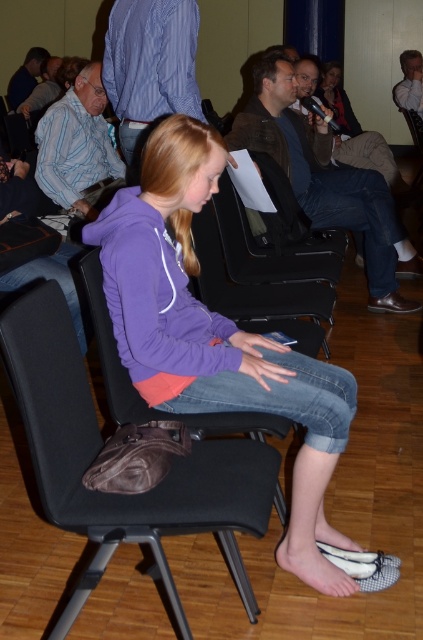
Question: Which of the following is the closest to the observer?

Choices:
 (A) purple fleece jacket at center
 (B) black fabric chair at center

Answer: (B)

Question: Does purple fleece jacket at center have a lesser width compared to black fabric chair at center?

Choices:
 (A) yes
 (B) no

Answer: (B)

Question: Can you confirm if purple fleece jacket at center is positioned above black fabric chair at center?

Choices:
 (A) no
 (B) yes

Answer: (B)

Question: Observing the image, what is the correct spatial positioning of purple fleece jacket at center in reference to black fabric chair at center?

Choices:
 (A) below
 (B) above

Answer: (B)